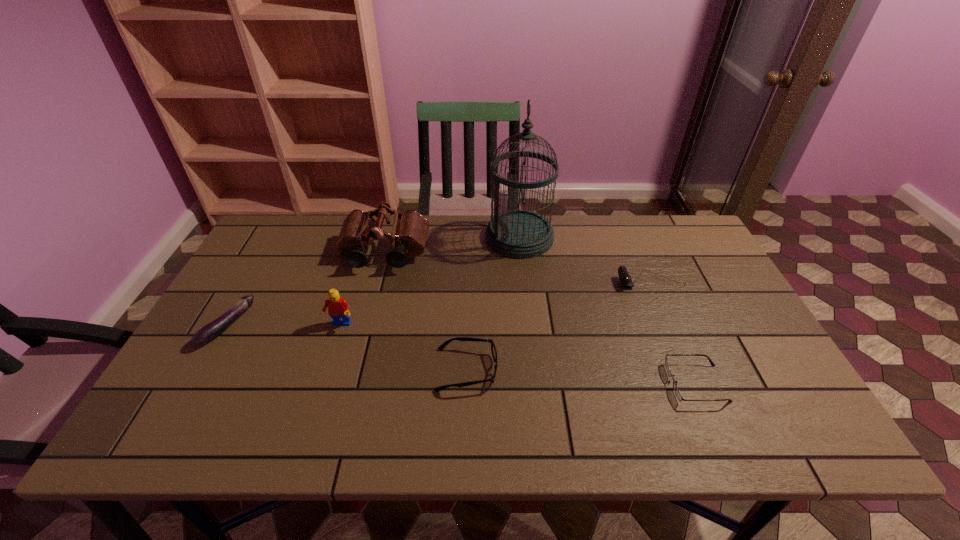
The width and height of the screenshot is (960, 540). I want to click on vacant space at the far left corner, so click(x=300, y=253).

Identify the location of vacant region at the far right corner of the desktop. (672, 253).

In the image, there is a desktop. In order to click on vacant space at the near right corner in this screenshot , I will do `click(785, 417)`.

The image size is (960, 540). What are the coordinates of `vacant region between the tallest object and the shortest object` in the screenshot? It's located at (608, 310).

This screenshot has height=540, width=960. I want to click on vacant space that is in between the webcam and the Lego, so click(495, 303).

This screenshot has width=960, height=540. Find the location of `vacant area that lies between the eggplant and the shortest object`. vacant area that lies between the eggplant and the shortest object is located at coordinates (462, 355).

Identify the location of free spot between the Lego and the taller spectacles. 403,347.

I want to click on empty space that is in between the webcam and the shorter spectacles, so click(674, 332).

Locate an element on the screen. The height and width of the screenshot is (540, 960). blank region between the Lego and the webcam is located at coordinates (495, 303).

Identify the location of unoccupied position between the webcam and the birdcage. The image size is (960, 540). (586, 259).